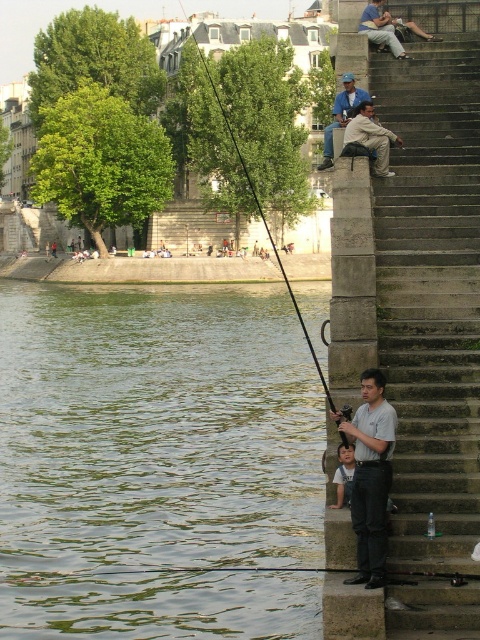
Question: Can you confirm if gray cotton shirt at lower right is positioned to the left of light blue cotton shirt at lower center?

Choices:
 (A) yes
 (B) no

Answer: (B)

Question: Which object is closer to the camera taking this photo?

Choices:
 (A) blue denim jacket at upper center
 (B) greenish water at lower left

Answer: (B)

Question: Is light brown fabric pants at upper right positioned behind light blue cotton shirt at lower center?

Choices:
 (A) yes
 (B) no

Answer: (A)

Question: Is light brown fabric pants at upper right thinner than blue denim jacket at upper center?

Choices:
 (A) yes
 (B) no

Answer: (A)

Question: Among these objects, which one is nearest to the camera?

Choices:
 (A) concrete stairs at right
 (B) light blue denim jeans at upper right

Answer: (A)

Question: Which object appears closest to the camera in this image?

Choices:
 (A) light blue denim jeans at upper right
 (B) light blue cotton shirt at lower center

Answer: (B)